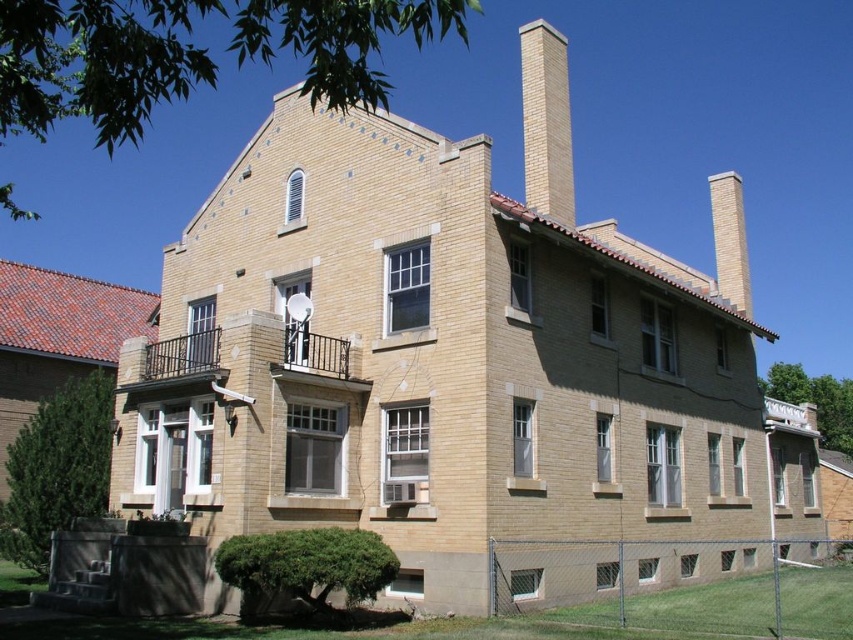
Question: Which of the following is the closest to the observer?

Choices:
 (A) smooth tan brick chimney at upper right
 (B) yellow brick chimney at upper center

Answer: (B)

Question: Is yellow brick chimney at upper center positioned before smooth tan brick chimney at upper right?

Choices:
 (A) no
 (B) yes

Answer: (B)

Question: Can you confirm if yellow brick chimney at upper center is positioned to the right of smooth tan brick chimney at upper right?

Choices:
 (A) yes
 (B) no

Answer: (B)

Question: Which object appears farthest from the camera in this image?

Choices:
 (A) metallic chain-link fence at lower right
 (B) yellow brick chimney at upper center
 (C) smooth tan brick chimney at upper right

Answer: (C)

Question: Can you confirm if metallic chain-link fence at lower right is positioned to the left of yellow brick chimney at upper center?

Choices:
 (A) yes
 (B) no

Answer: (B)

Question: Which point appears closest to the camera in this image?

Choices:
 (A) (709, 182)
 (B) (677, 625)

Answer: (B)